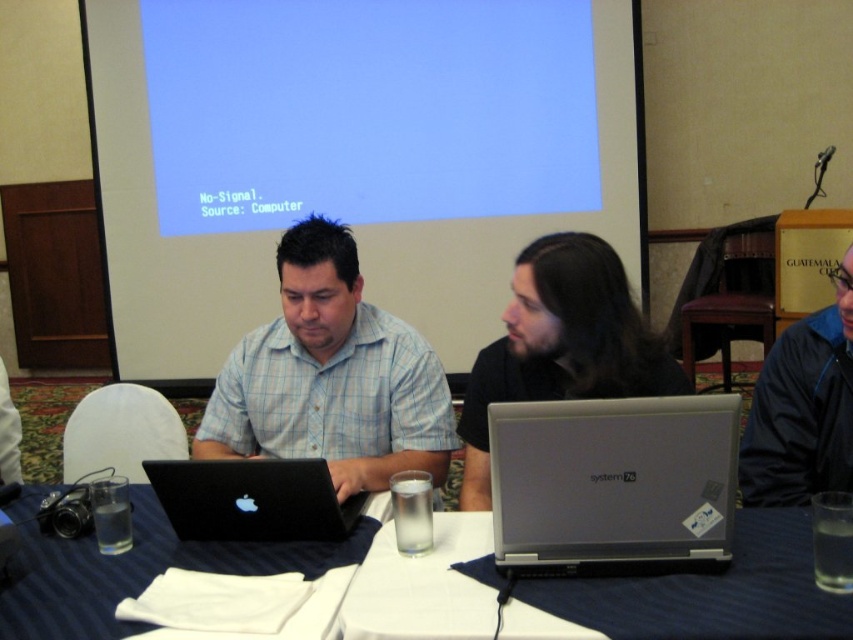
You are organizing a tech showcase and need to stack the silver metallic laptop at center and the black matte laptop at center vertically. Can you place the taller one on top to ensure stability?

The silver metallic laptop at center is taller than the black matte laptop at center, so placing the taller one on top would not be stable. To ensure stability, the taller laptop should be placed at the bottom.

What is the exact coordinate of the silver metallic laptop at center?

The silver metallic laptop at center is located at point (613,483).

You are an event planner setting up a conference room. You need to ensure that the blue matte projection screen at upper center and the black matte hair at center are visible to all attendees. Which object is positioned higher in the image?

The blue matte projection screen at upper center is taller than the black matte hair at center, so it is positioned higher in the image.